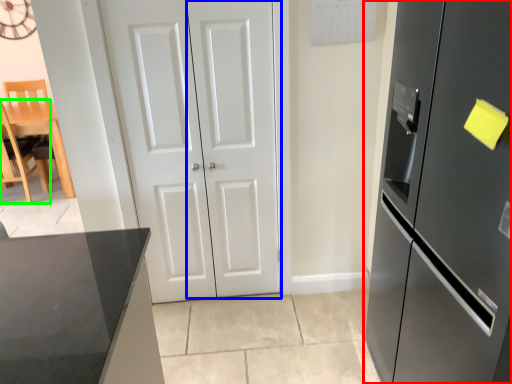
Question: Which is nearer to the refrigerator (highlighted by a red box)? door (highlighted by a blue box) or chair (highlighted by a green box).

Choices:
 (A) door
 (B) chair

Answer: (A)